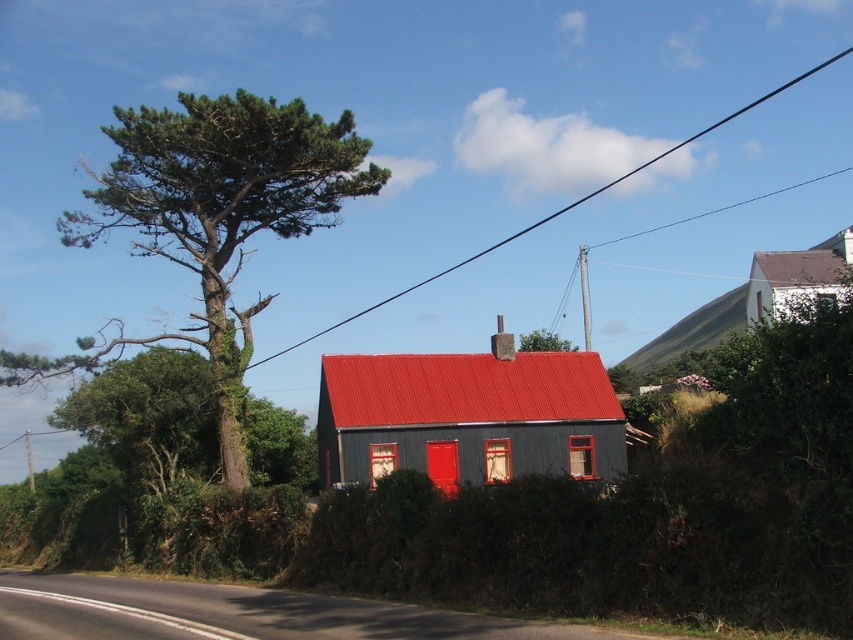
Is green textured tree at upper left positioned before gray slate roof at upper right?

No, green textured tree at upper left is further to the viewer.

Is green textured tree at upper left below gray slate roof at upper right?

Actually, green textured tree at upper left is above gray slate roof at upper right.

Which is in front, point (50, 371) or point (848, 257)?

Point (50, 371) is in front.

Where is `green textured tree at upper left`? Image resolution: width=853 pixels, height=640 pixels. green textured tree at upper left is located at coordinates (212, 221).

Locate an element on the screen. red corrugated metal house at center is located at coordinates (468, 416).

Does red corrugated metal house at center have a larger size compared to green leafy tree at upper center?

Actually, red corrugated metal house at center might be smaller than green leafy tree at upper center.

Describe the element at coordinates (468, 416) in the screenshot. I see `red corrugated metal house at center` at that location.

This screenshot has height=640, width=853. I want to click on red corrugated metal house at center, so click(x=468, y=416).

Which is more to the right, red corrugated metal house at center or gray slate roof at upper right?

gray slate roof at upper right is more to the right.

Between red corrugated metal house at center and gray slate roof at upper right, which one appears on the left side from the viewer's perspective?

Positioned to the left is red corrugated metal house at center.

The image size is (853, 640). What do you see at coordinates (468, 416) in the screenshot?
I see `red corrugated metal house at center` at bounding box center [468, 416].

You are a GUI agent. You are given a task and a screenshot of the screen. Output one action in this format:
    pyautogui.click(x=<x>, y=<y>)
    Task: Click on the red corrugated metal house at center
    
    Given the screenshot: What is the action you would take?
    pyautogui.click(x=468, y=416)